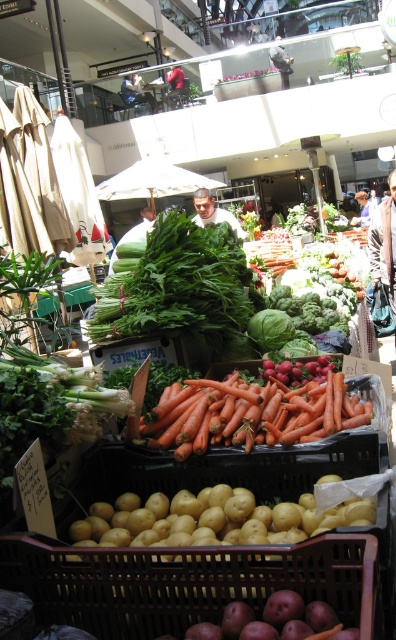
You are a customer in the market and want to see both the smooth brown leather jacket at center and the red fabric jacket at center. Which one do you need to move closer to first?

The smooth brown leather jacket at center is in front of the red fabric jacket at center, so you need to move closer to the smooth brown leather jacket at center first to see both.

You are standing at the entrance of the market and see the red fabric jacket at center. If you want to reach the jacket quickly, can you walk directly towards it without needing to go around any obstacles?

The red fabric jacket at center is 54.05 feet away from the viewer, so you can walk directly towards it without needing to go around any obstacles since there are no mentioned obstacles in the scene description.